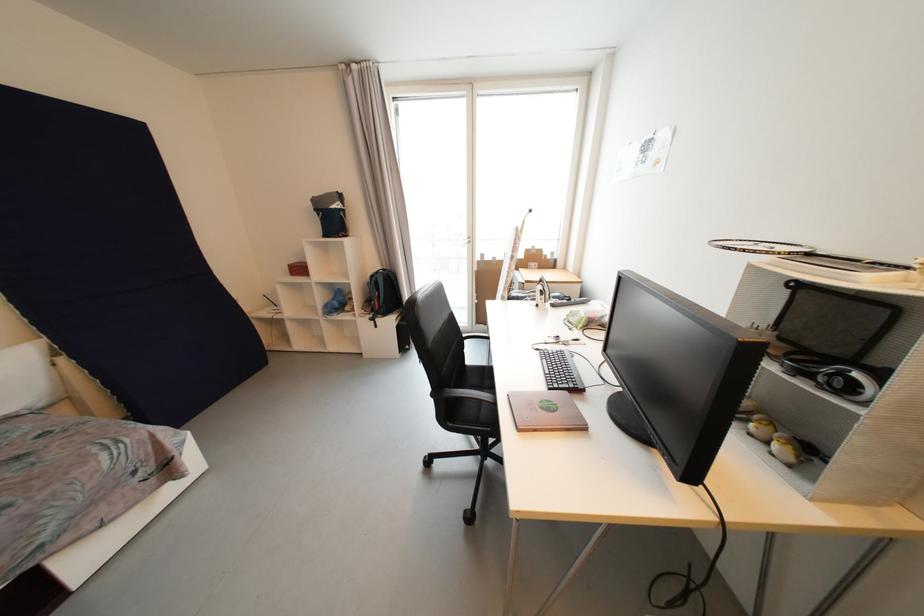
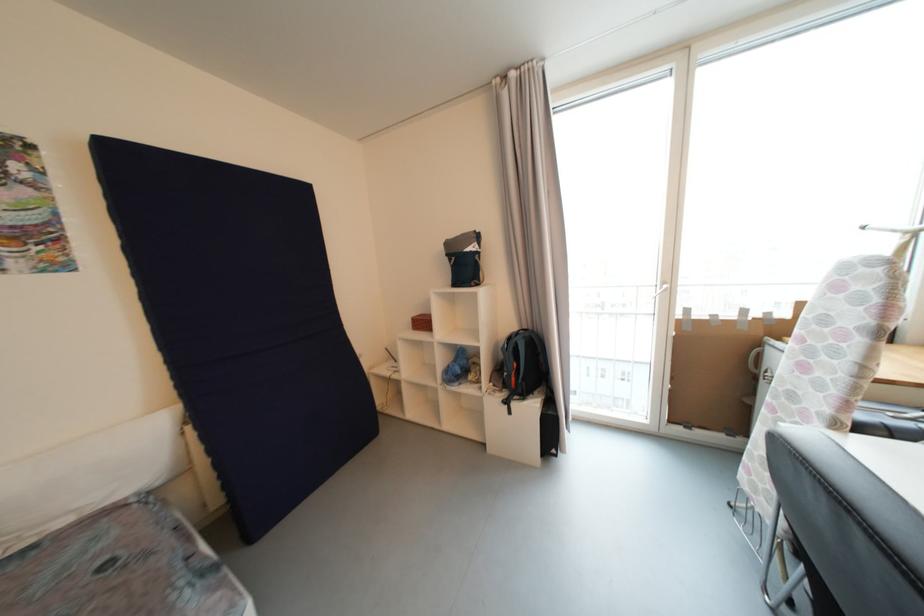
Question: The camera is either moving clockwise (left) or counter-clockwise (right) around the object. The first image is from the beginning of the video and the second image is from the end. Is the camera moving left or right when shooting the video?

Choices:
 (A) Left
 (B) Right

Answer: (B)